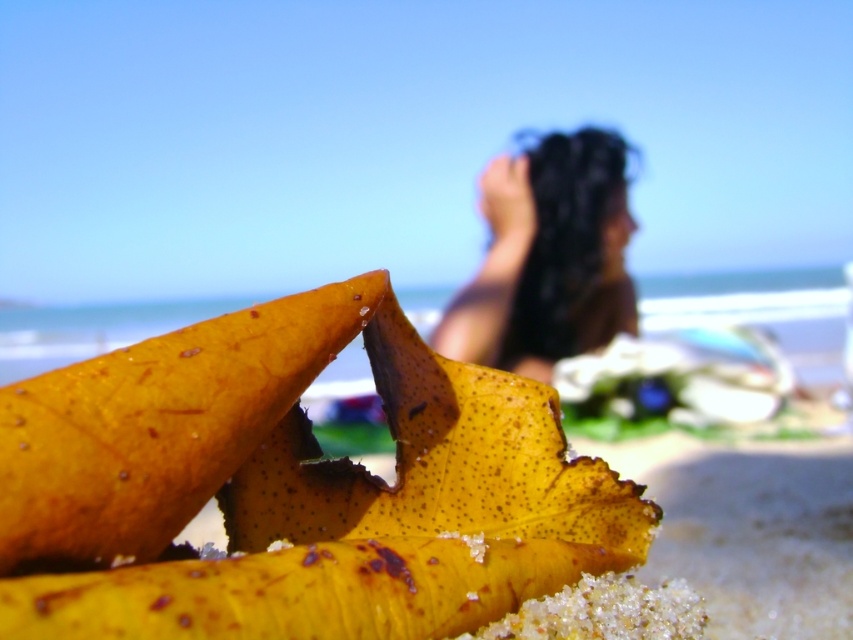
Question: Which point is farther to the camera?

Choices:
 (A) (497, 467)
 (B) (535, 250)

Answer: (B)

Question: Among these points, which one is nearest to the camera?

Choices:
 (A) (457, 404)
 (B) (577, 276)

Answer: (A)

Question: Is yellow papery banana at center in front of dark brown hair at upper center?

Choices:
 (A) no
 (B) yes

Answer: (B)

Question: Does yellow papery banana at center appear on the right side of dark brown hair at upper center?

Choices:
 (A) no
 (B) yes

Answer: (A)

Question: Is yellow papery banana at center above dark brown hair at upper center?

Choices:
 (A) yes
 (B) no

Answer: (B)